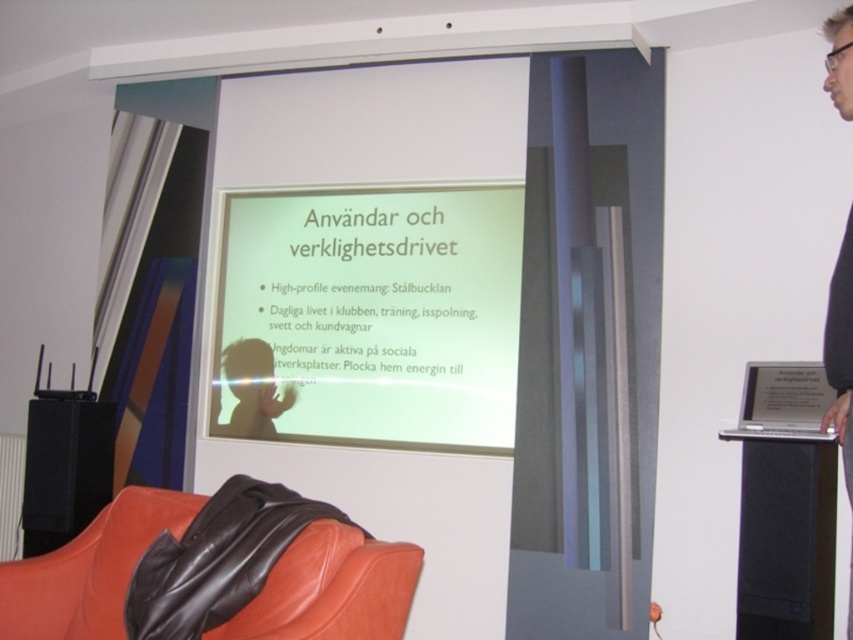
Can you confirm if leather-like orange armchair at lower left is bigger than black fabric at upper right?

No, leather-like orange armchair at lower left is not bigger than black fabric at upper right.

Between leather-like orange armchair at lower left and black fabric at upper right, which one has more height?

With more height is black fabric at upper right.

Between point (16, 573) and point (838, 67), which one is positioned in front?

Point (838, 67)

Locate an element on the screen. This screenshot has height=640, width=853. leather-like orange armchair at lower left is located at coordinates (331, 589).

Who is lower down, white matte projector screen at center or leather-like orange armchair at lower left?

Positioned lower is leather-like orange armchair at lower left.

Consider the image. Which of these two, white matte projector screen at center or leather-like orange armchair at lower left, stands taller?

white matte projector screen at center is taller.

At what (x,y) coordinates should I click in order to perform the action: click on white matte projector screen at center. Please return your answer as a coordinate pair (x, y). Looking at the image, I should click on (369, 317).

The height and width of the screenshot is (640, 853). What are the coordinates of `white matte projector screen at center` in the screenshot? It's located at (369, 317).

Between white matte projector screen at center and black fabric at upper right, which one appears on the left side from the viewer's perspective?

white matte projector screen at center is more to the left.

Can you confirm if white matte projector screen at center is positioned to the left of black fabric at upper right?

Yes, white matte projector screen at center is to the left of black fabric at upper right.

Which is behind, point (346, 301) or point (833, 374)?

Point (346, 301)

Where is `white matte projector screen at center`? white matte projector screen at center is located at coordinates (369, 317).